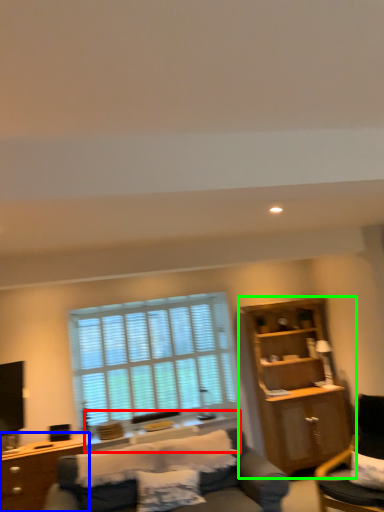
Question: Which object is positioned closest to side table (highlighted by a red box)? Select from desk (highlighted by a blue box) and cabinetry (highlighted by a green box).

Choices:
 (A) desk
 (B) cabinetry

Answer: (A)